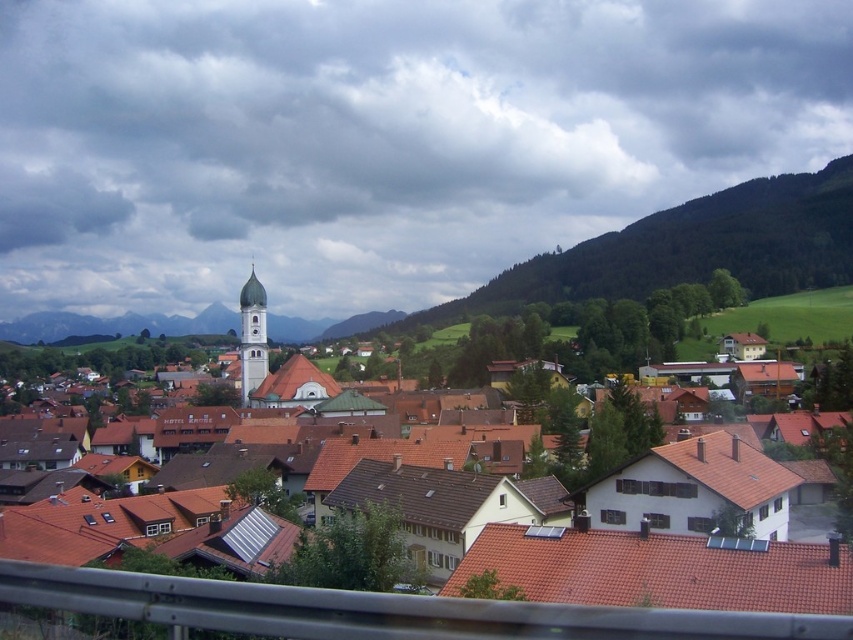
You are a photographer planning to take a photo of the light gray stone bell tower at center and the green forested mountain at upper center. From your current position, which of the two objects will appear closer to you in the photo?

The green forested mountain at upper center will appear closer to you in the photo because the light gray stone bell tower at center is behind it, meaning the mountain is in front of the bell tower.

You are a photographer planning to capture the entire town in one shot. Given that the brown tiled roofs at center and the light gray stone bell tower at center are both in your frame, which object will occupy more horizontal space in the photo?

The brown tiled roofs at center will occupy more horizontal space in the photo because their width surpasses that of the light gray stone bell tower at center.

You are standing at the viewpoint overlooking the town and want to take a photo. There are two points of interest marked on your map at coordinates point (x=645, y=284) and point (x=253, y=276). Which point is closer to your current position?

Point (x=645, y=284) is further to the camera than point (x=253, y=276), so the closer point to your current position is point (x=253, y=276).